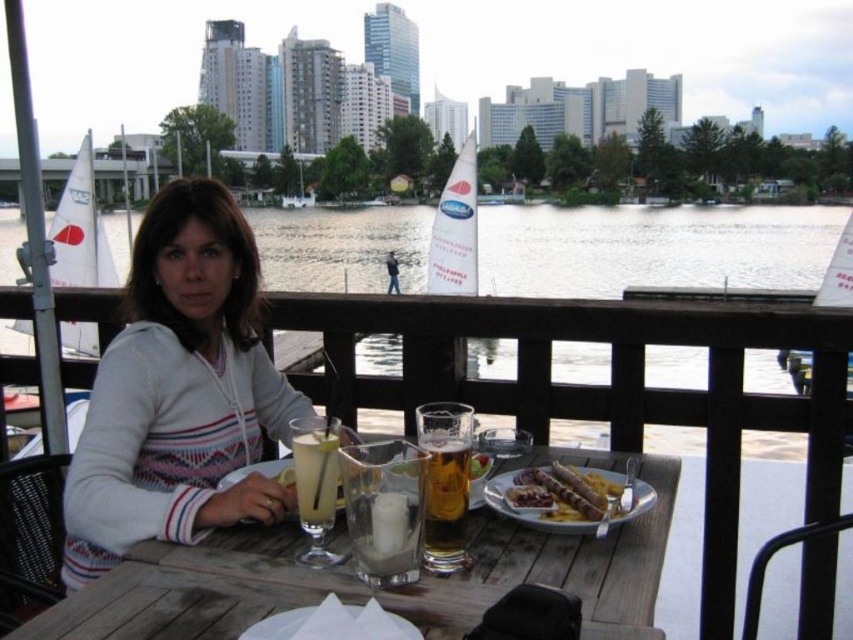
In the scene shown: Can you confirm if translucent glass beer at center is positioned to the left of clear glass at center?

Incorrect, translucent glass beer at center is not on the left side of clear glass at center.

The width and height of the screenshot is (853, 640). Describe the element at coordinates (445, 500) in the screenshot. I see `translucent glass beer at center` at that location.

Between point (434, 483) and point (334, 496), which one is positioned in front?

Point (434, 483) is more forward.

The image size is (853, 640). I want to click on translucent glass beer at center, so click(x=445, y=500).

Can you confirm if transparent glass water at center is positioned to the right of clear glass at center?

Incorrect, transparent glass water at center is not on the right side of clear glass at center.

Is point (637, 227) less distant than point (331, 515)?

No, it is not.

At what (x,y) coordinates should I click in order to perform the action: click on transparent glass water at center. Please return your answer as a coordinate pair (x, y). The image size is (853, 640). Looking at the image, I should click on (653, 248).

Does wooden table at center have a greater height compared to clear glass at center?

In fact, wooden table at center may be shorter than clear glass at center.

Is point (671, 465) closer to viewer compared to point (302, 435)?

No, (671, 465) is behind (302, 435).

Image resolution: width=853 pixels, height=640 pixels. I want to click on wooden table at center, so click(x=366, y=586).